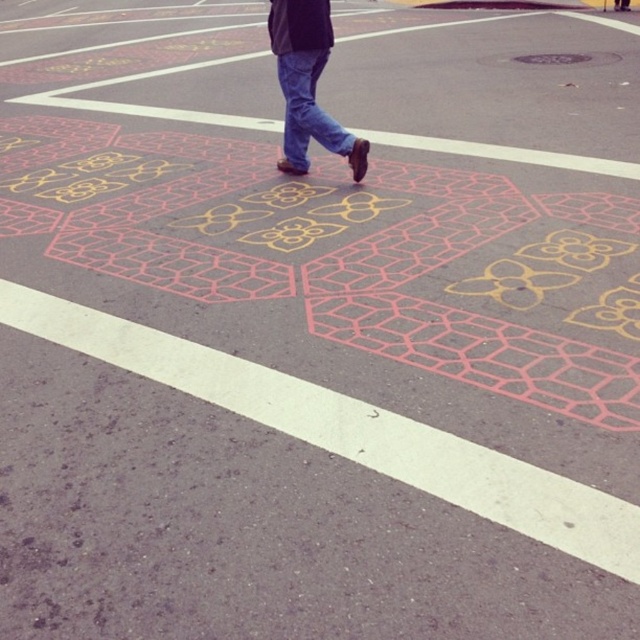
What do you see at coordinates (307, 84) in the screenshot? I see `blue jeans at center` at bounding box center [307, 84].

Is blue jeans at center wider than blue denim jeans at center?

Correct, the width of blue jeans at center exceeds that of blue denim jeans at center.

Is point (316, 118) closer to camera compared to point (307, 81)?

No, it is behind (307, 81).

Identify the location of blue jeans at center. Image resolution: width=640 pixels, height=640 pixels. (307, 84).